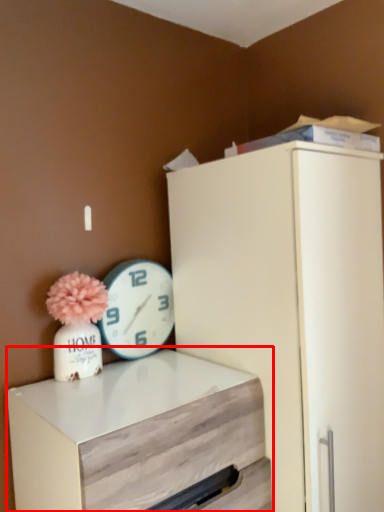
Question: In this image, where is chest of drawers (annotated by the red box) located relative to wall clock?

Choices:
 (A) right
 (B) left

Answer: (A)